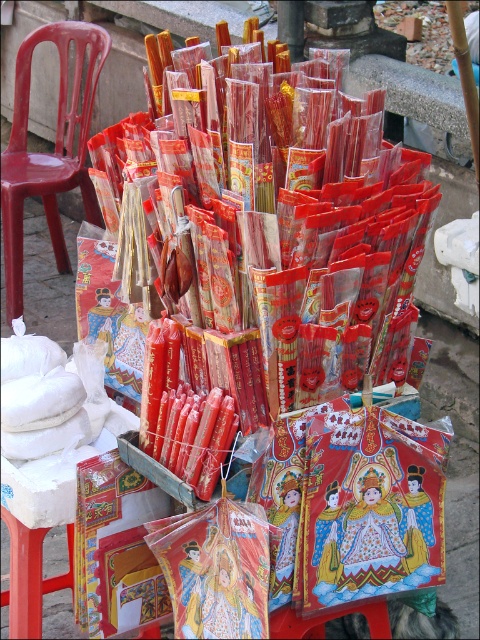
Between matte red incense sticks at center and matte plastic chair at left, which one has less height?

matte red incense sticks at center

Does point (225, 96) come behind point (78, 148)?

No.

Is point (414, 284) positioned in front of point (22, 260)?

Yes, point (414, 284) is closer to viewer.

This screenshot has width=480, height=640. What are the coordinates of `matte red incense sticks at center` in the screenshot? It's located at (307, 205).